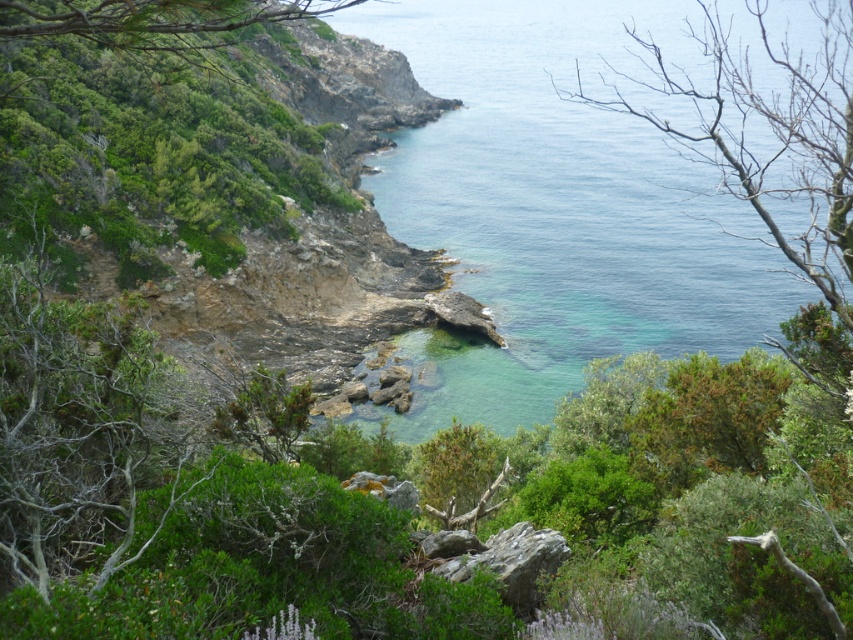
Which is below, bare branches at upper right or rusty rock at center?

rusty rock at center

Which is more to the left, bare branches at upper right or rusty rock at center?

rusty rock at center

Identify the location of bare branches at upper right. (769, 132).

Consider the image. Does clear blue water at center appear under bare branches at upper right?

Actually, clear blue water at center is above bare branches at upper right.

Based on the photo, is clear blue water at center further to the viewer compared to bare branches at upper right?

Yes, clear blue water at center is behind bare branches at upper right.

Between point (567, 33) and point (653, 67), which one is positioned behind?

The point (567, 33) is more distant.

Locate an element on the screen. Image resolution: width=853 pixels, height=640 pixels. clear blue water at center is located at coordinates (561, 204).

Is bare branches at upper right to the right of green leafy tree at upper left from the viewer's perspective?

Indeed, bare branches at upper right is positioned on the right side of green leafy tree at upper left.

Is bare branches at upper right thinner than green leafy tree at upper left?

No.

This screenshot has width=853, height=640. What do you see at coordinates (769, 132) in the screenshot? I see `bare branches at upper right` at bounding box center [769, 132].

Find the location of a particular element. The image size is (853, 640). bare branches at upper right is located at coordinates (769, 132).